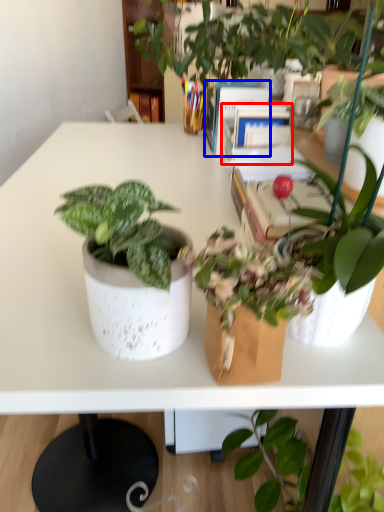
Question: Which of the following is the farthest to the observer, book (highlighted by a red box) or book (highlighted by a blue box)?

Choices:
 (A) book
 (B) book

Answer: (B)